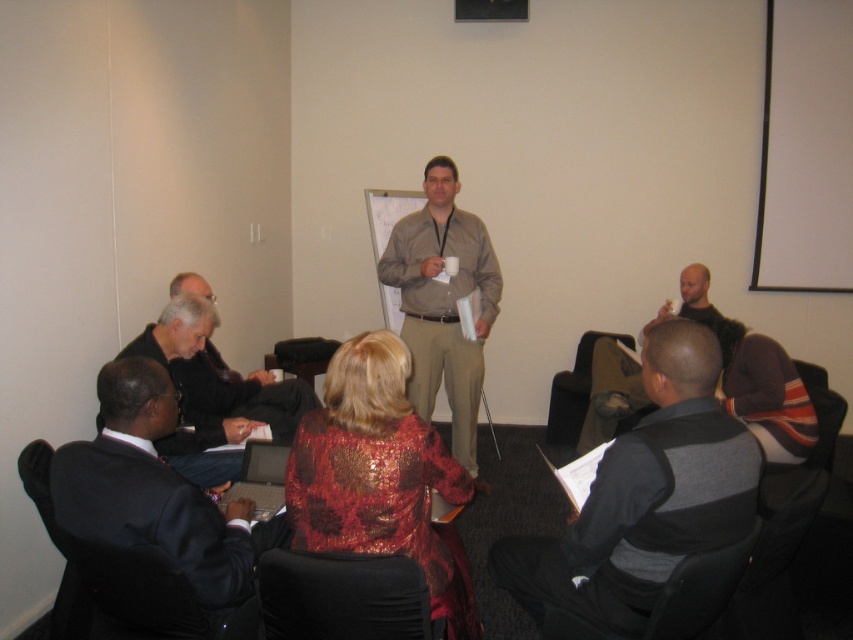
In the meeting scene, there is a dark suit at lower left and a dark brown leather jacket at upper right. Which of these two items is positioned more to the left side of the image?

The dark suit at lower left is positioned to the left of the dark brown leather jacket at upper right, so the dark suit at lower left is more to the left.

You are sitting in the brown fabric chair at lower center and want to hand a document to the person wearing the striped sweater at lower right. Which direction should you move to reach them?

The striped sweater at lower right is to the left of the brown fabric chair at lower center, so you should move to your left to reach them.